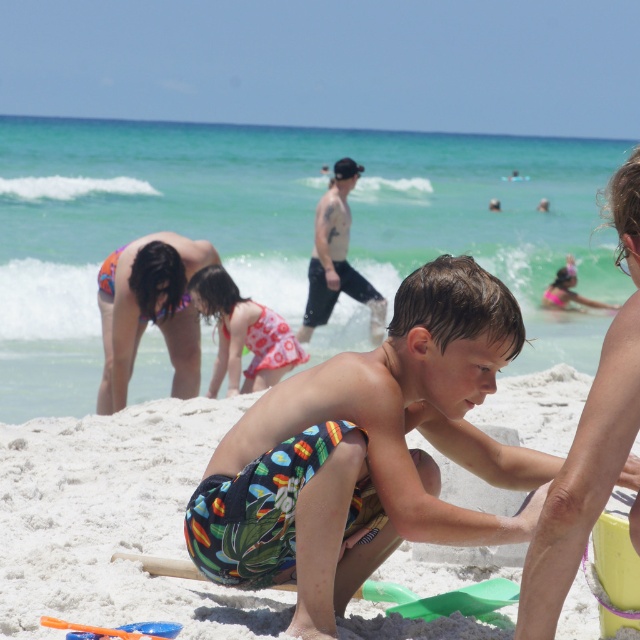
You are a photographer trying to capture a wide shot of the white sandy beach at center and the printed bikini at lower left. Which object should you focus on first to ensure it appears larger in the photo?

The printed bikini at lower left should be focused on first because it is larger in size compared to the white sandy beach at center.

You are a beachgoer who wants to retrieve the translucent plastic shovel at lower left. However, the printed bikini at lower left is blocking your path. Can you reach the shovel without moving the bikini?

The translucent plastic shovel at lower left is behind the printed bikini at lower left, so you can reach the shovel by moving around the bikini or bending down behind it without needing to move the bikini itself.